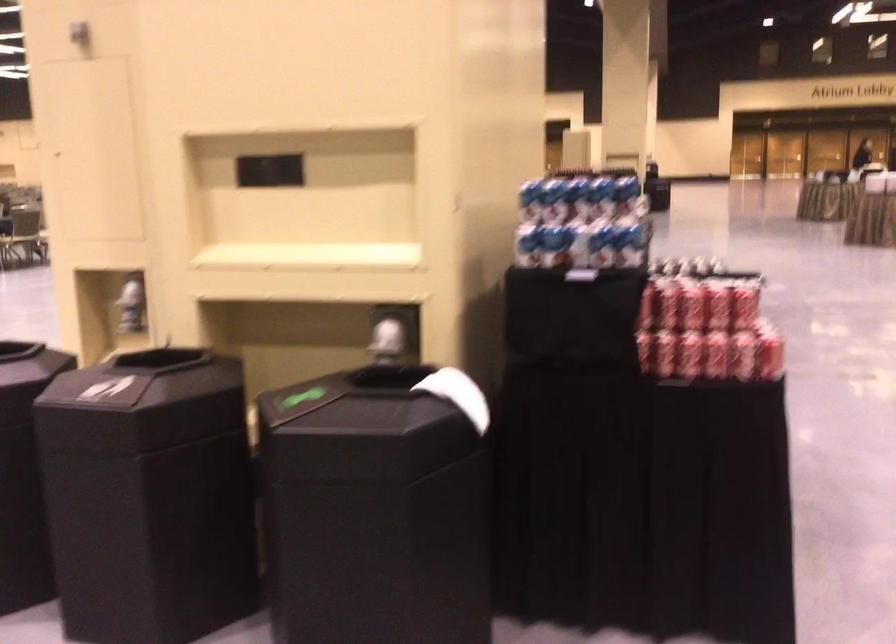
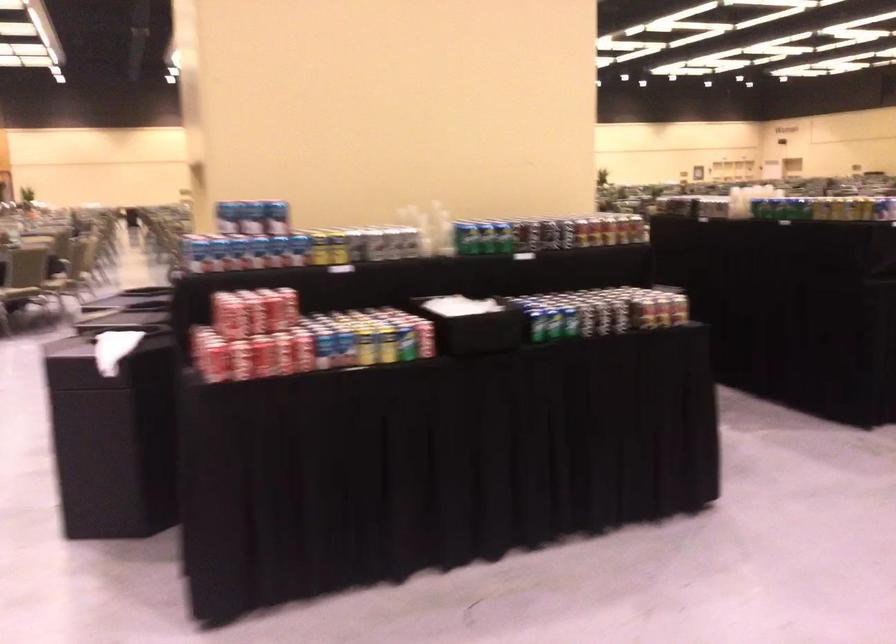
Locate, in the second image, the point that corresponds to the point at 787,353 in the first image.

(211, 361)